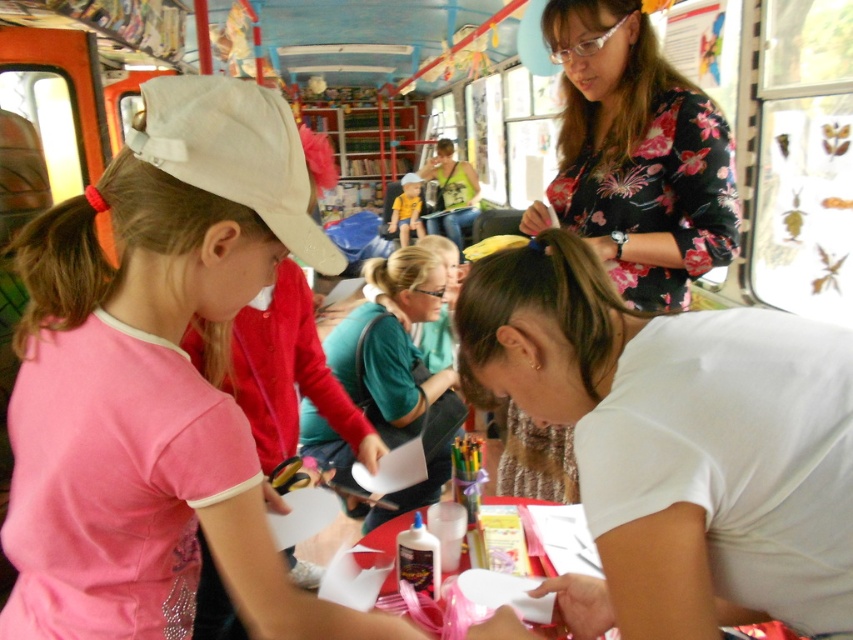
What is the 2D coordinate of the white matte shirt at lower right in the image?

The white matte shirt at lower right is located at the 2D coordinate point of (677, 444).

You are standing in the bus and want to reach the yellow shirt at center from the white matte shirt at lower right. Which direction should you move?

You should move to the left because the white matte shirt at lower right is to the right of the yellow shirt at center, so moving left will bring you closer to the yellow shirt at center.

From the picture: You are standing at the back of the bus and want to hand a craft kit to both the green matte shirt at center and the matte yellow shirt at center. Which one should you approach first to ensure you can reach them both without moving around the table?

You should approach the green matte shirt at center first because it is located below the matte yellow shirt at center, meaning it is closer to you. After reaching the green matte shirt at center, you can then move upwards to hand the kit to the matte yellow shirt at center.